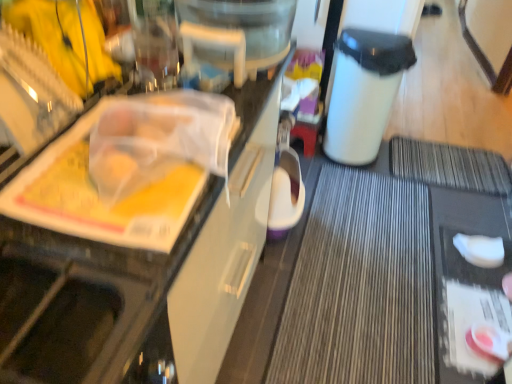
Question: Considering the relative sizes of white matte sponge at lower right, arranged as the second food when viewed from the front, and white plastic trash bin at center-right in the image provided, is white matte sponge at lower right, arranged as the second food when viewed from the front, bigger than white plastic trash bin at center-right?

Choices:
 (A) no
 (B) yes

Answer: (A)

Question: Can you confirm if white matte sponge at lower right, which appears as the first food when viewed from the back, is taller than white plastic trash bin at center-right?

Choices:
 (A) yes
 (B) no

Answer: (B)

Question: Can you confirm if white matte sponge at lower right, which ranks as the 2th food in bottom-to-top order, is positioned to the left of white plastic trash bin at center-right?

Choices:
 (A) no
 (B) yes

Answer: (A)

Question: Considering the relative sizes of white matte sponge at lower right, the 1th food in the top-to-bottom sequence, and white plastic trash bin at center-right in the image provided, is white matte sponge at lower right, the 1th food in the top-to-bottom sequence, thinner than white plastic trash bin at center-right?

Choices:
 (A) no
 (B) yes

Answer: (B)

Question: Can you confirm if white matte sponge at lower right, the 1th food in the top-to-bottom sequence, is wider than white plastic trash bin at center-right?

Choices:
 (A) yes
 (B) no

Answer: (B)

Question: From the image's perspective, is white matte sponge at lower right, which appears as the first food when viewed from the back, above or below white plastic tray at upper left?

Choices:
 (A) above
 (B) below

Answer: (B)

Question: Is white matte sponge at lower right, arranged as the second food when viewed from the front, to the left or to the right of white plastic tray at upper left in the image?

Choices:
 (A) right
 (B) left

Answer: (A)

Question: Considering the positions of white matte sponge at lower right, which appears as the first food when viewed from the back, and white plastic tray at upper left in the image, is white matte sponge at lower right, which appears as the first food when viewed from the back, bigger or smaller than white plastic tray at upper left?

Choices:
 (A) big
 (B) small

Answer: (B)

Question: Is white matte sponge at lower right, arranged as the second food when viewed from the front, inside the boundaries of white plastic tray at upper left, or outside?

Choices:
 (A) outside
 (B) inside

Answer: (A)

Question: Is point (493, 350) closer or farther from the camera than point (145, 370)?

Choices:
 (A) farther
 (B) closer

Answer: (A)

Question: Is pink glossy jar at lower right, which is the second food from back to front, situated inside white plastic tray at upper left or outside?

Choices:
 (A) inside
 (B) outside

Answer: (B)

Question: Looking at their shapes, would you say pink glossy jar at lower right, which appears as the first food when ordered from the bottom, is wider or thinner than white plastic tray at upper left?

Choices:
 (A) thin
 (B) wide

Answer: (A)

Question: From the image's perspective, relative to white plastic tray at upper left, is pink glossy jar at lower right, the second food in the top-to-bottom sequence, above or below?

Choices:
 (A) below
 (B) above

Answer: (A)

Question: Considering their positions, is white plastic tray at upper left located in front of or behind pink glossy jar at lower right, marked as the first food in a front-to-back arrangement?

Choices:
 (A) front
 (B) behind

Answer: (A)

Question: In terms of size, does white plastic tray at upper left appear bigger or smaller than pink glossy jar at lower right, which appears as the first food when ordered from the bottom?

Choices:
 (A) big
 (B) small

Answer: (A)